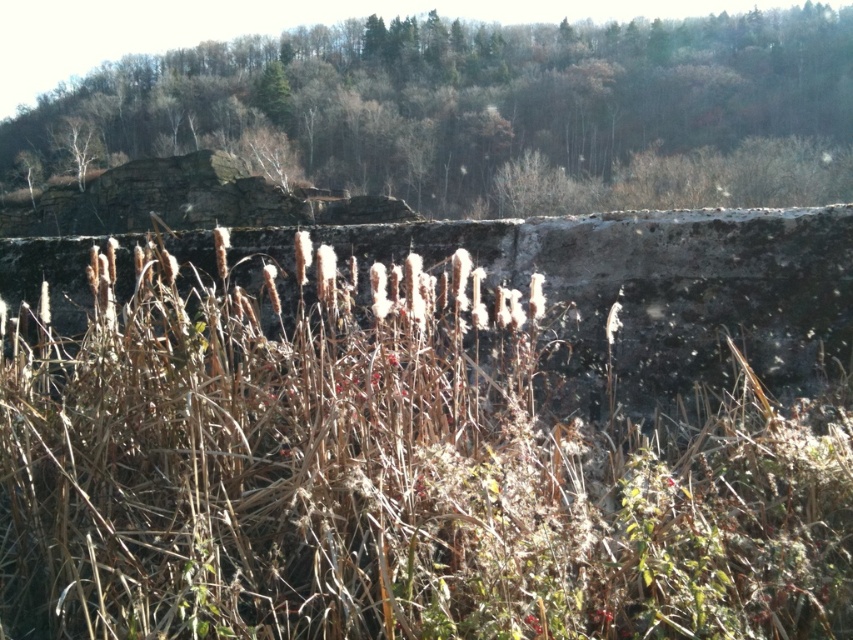
You are a botanist studying grasses in this landscape. You notice two types of grasses at the center of the image. Which one is smaller in size between the brown grass at center and the brown dry grass at center?

The brown grass at center is smaller in size compared to the brown dry grass at center.